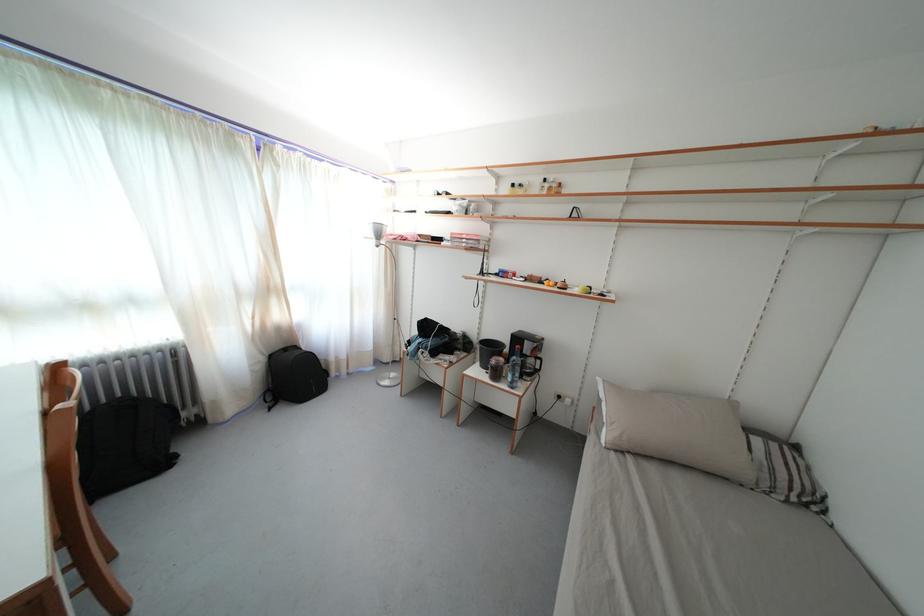
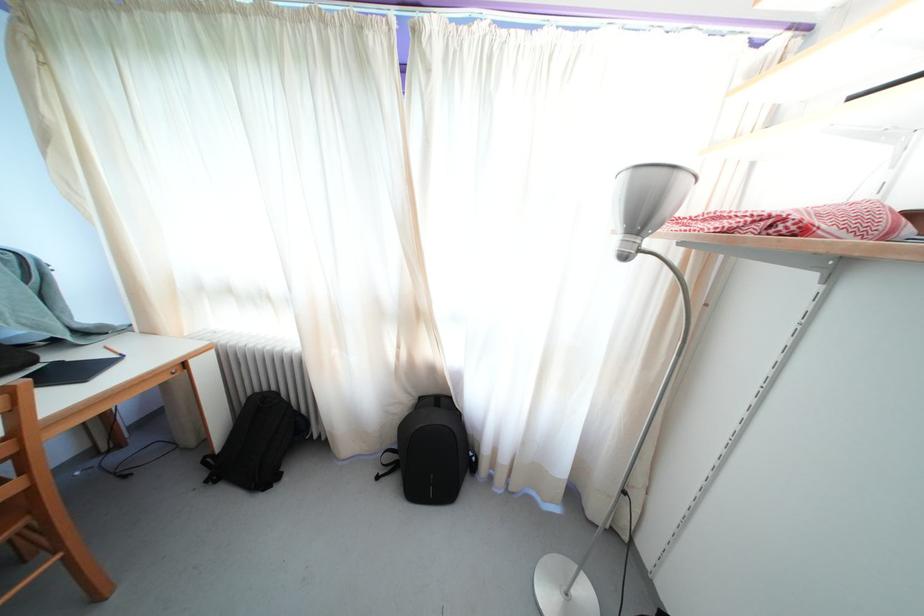
The point at (167, 469) is marked in the first image. Where is the corresponding point in the second image?

(271, 485)